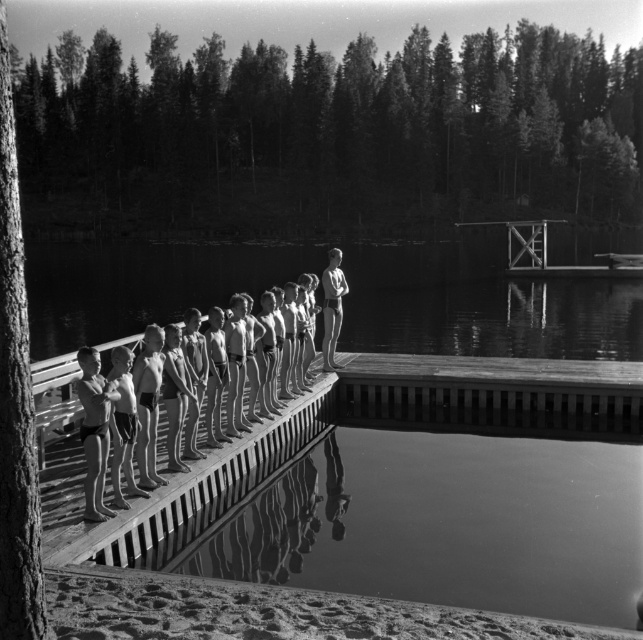
You are a lifeguard at the lakeside and need to ensure all children are visible from your post. The smooth skin children at center and the smooth skin boy at center are both in your line of sight. Which child would you need to adjust their position to ensure visibility?

The smooth skin children at center has a lesser height compared to the smooth skin boy at center. Therefore, you would need to adjust the position of the smooth skin children at center to ensure they are visible.

You are a photographer standing on the wooden platform and want to take a picture of the smooth skin children at center and the smooth skin boy at center. Which one is positioned lower in the frame?

The smooth skin children at center is located below smooth skin boy at center, so the smooth skin children at center is positioned lower in the frame.